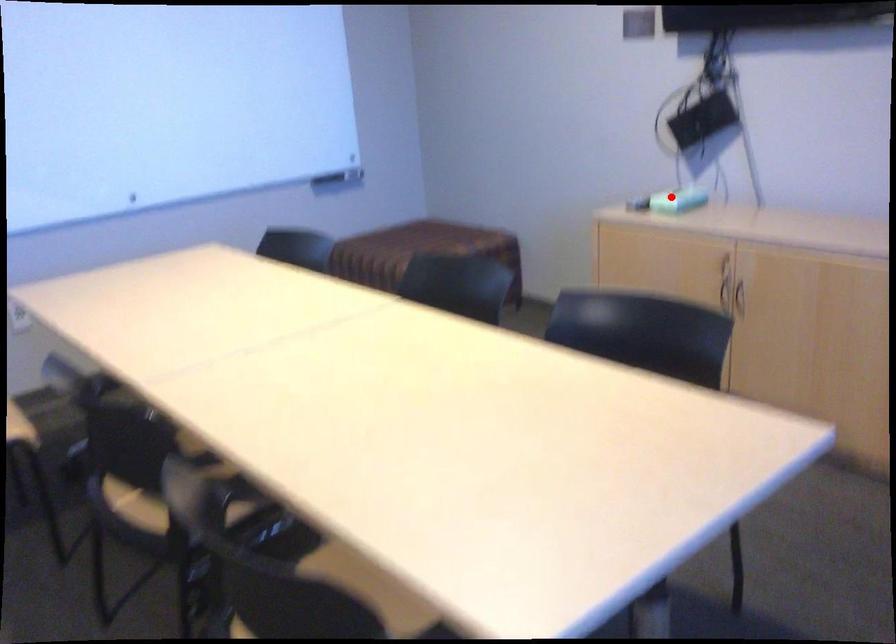
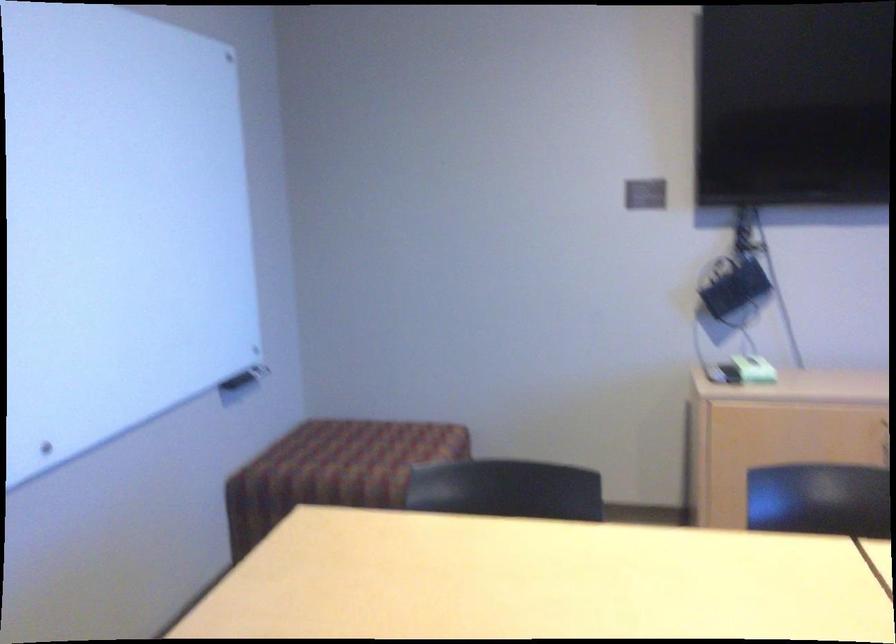
Locate, in the second image, the point that corresponds to the highlighted location in the first image.

(754, 368)